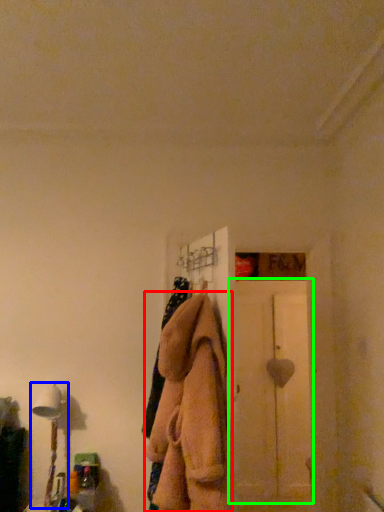
Question: Which is farther away from clothing (highlighted by a red box)? table lamp (highlighted by a blue box) or screen door (highlighted by a green box)?

Choices:
 (A) table lamp
 (B) screen door

Answer: (B)